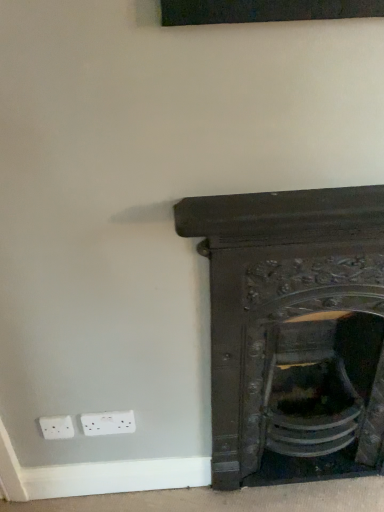
Question: Considering the relative positions of dark wood fireplace at lower right and white plastic electric outlet at lower left in the image provided, is dark wood fireplace at lower right to the left or to the right of white plastic electric outlet at lower left?

Choices:
 (A) left
 (B) right

Answer: (B)

Question: From the image's perspective, relative to white plastic electric outlet at lower left, is dark wood fireplace at lower right above or below?

Choices:
 (A) above
 (B) below

Answer: (A)

Question: From a real-world perspective, relative to white plastic electric outlet at lower left, is dark wood fireplace at lower right vertically above or below?

Choices:
 (A) above
 (B) below

Answer: (A)

Question: Looking at their shapes, would you say white plastic electric outlet at lower left is wider or thinner than dark wood fireplace at lower right?

Choices:
 (A) wide
 (B) thin

Answer: (B)

Question: Is white plastic electric outlet at lower left inside or outside of dark wood fireplace at lower right?

Choices:
 (A) inside
 (B) outside

Answer: (B)

Question: Considering the positions of white plastic electric outlet at lower left and dark wood fireplace at lower right in the image, is white plastic electric outlet at lower left bigger or smaller than dark wood fireplace at lower right?

Choices:
 (A) small
 (B) big

Answer: (A)

Question: From a real-world perspective, is white plastic electric outlet at lower left above or below dark wood fireplace at lower right?

Choices:
 (A) below
 (B) above

Answer: (A)